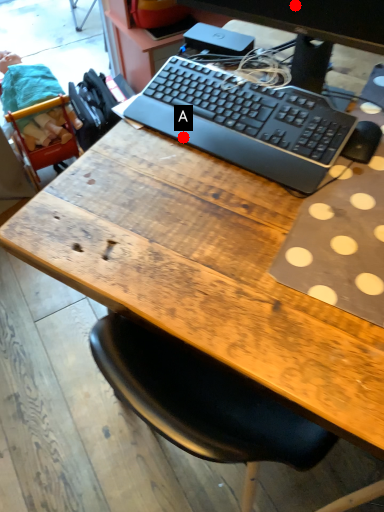
Question: Two points are circled on the image, labeled by A and B beside each circle. Which point appears farthest from the camera in this image?

Choices:
 (A) A is further
 (B) B is further

Answer: (A)